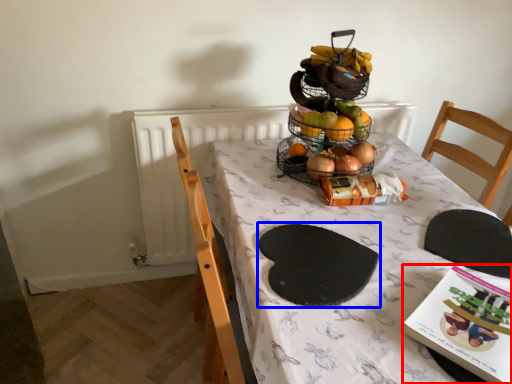
Question: Which of the following is the farthest to the observer, book (highlighted by a red box) or mat (highlighted by a blue box)?

Choices:
 (A) book
 (B) mat

Answer: (B)